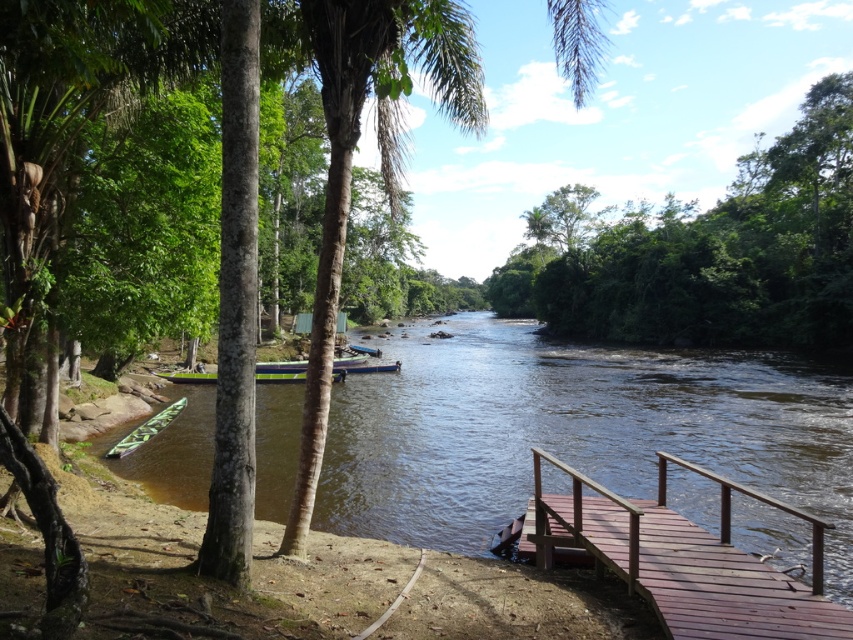
Is brown smooth river at center further to the viewer compared to brown wooden dock at lower right?

That is True.

Does brown smooth river at center have a greater height compared to brown wooden dock at lower right?

Incorrect, brown smooth river at center's height is not larger of brown wooden dock at lower right's.

Which is behind, point (636, 445) or point (659, 493)?

The point (636, 445) is more distant.

Where is `brown smooth river at center`? The image size is (853, 640). brown smooth river at center is located at coordinates (573, 432).

Which is above, brown wooden dock at lower right or green plastic boat at lower left?

brown wooden dock at lower right

Who is positioned more to the left, brown wooden dock at lower right or green plastic boat at lower left?

green plastic boat at lower left

Does point (572, 529) lie behind point (164, 420)?

No, (572, 529) is closer to viewer.

You are a GUI agent. You are given a task and a screenshot of the screen. Output one action in this format:
    pyautogui.click(x=<x>, y=<y>)
    Task: Click on the brown wooden dock at lower right
    
    Given the screenshot: What is the action you would take?
    pyautogui.click(x=682, y=560)

Does green leafy tree at upper center have a lesser height compared to brown wooden dock at lower right?

No.

The width and height of the screenshot is (853, 640). What are the coordinates of `green leafy tree at upper center` in the screenshot? It's located at (706, 252).